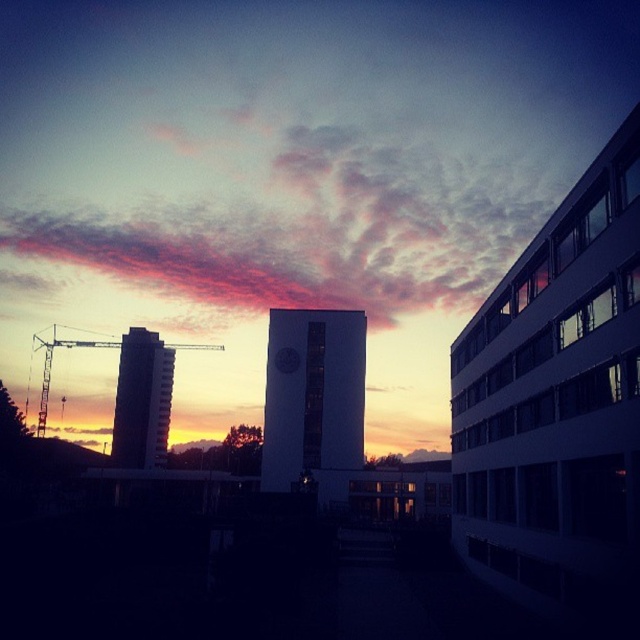
You are a drone operator flying a drone that needs to capture aerial footage of the silhouette glass tower at left and the metallic construction crane at left. Based on their positions, which object should you prioritize filming first to ensure you capture both without obstruction?

The silhouette glass tower at left should be filmed first because the metallic construction crane at left is positioned behind it, meaning if you film the crane first, the tower might block your view of it later.

You are an urban planner analyzing the skyline. Given the white smooth tower at center and the metallic construction crane at left, which one appears narrower from your vantage point?

The white smooth tower at center appears narrower than the metallic construction crane at left because it has a lesser width according to the description.